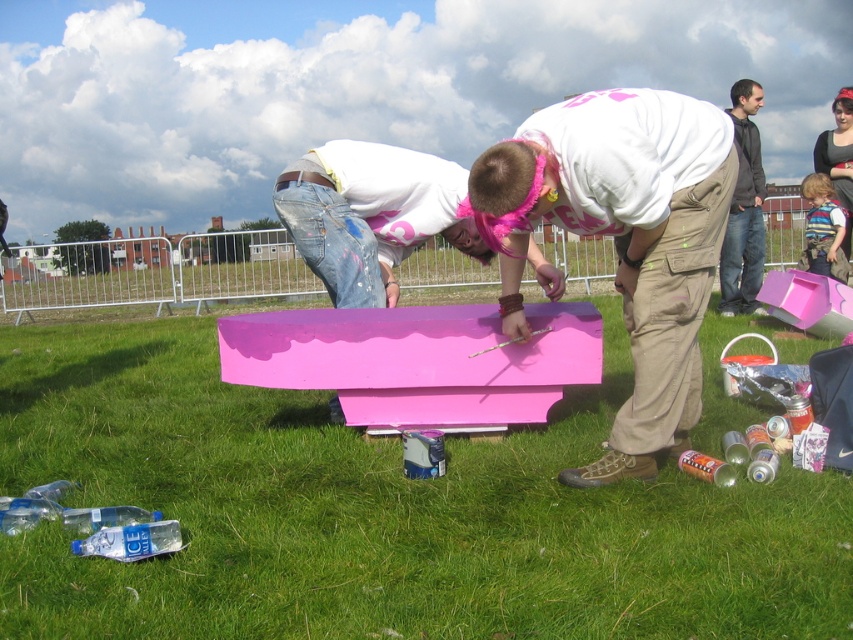
Can you confirm if pink matte paint can at center is thinner than striped sweater at lower right?

No.

Does pink matte paint can at center appear over striped sweater at lower right?

No, pink matte paint can at center is not above striped sweater at lower right.

Which is behind, point (370, 182) or point (846, 268)?

The point (846, 268) is more distant.

Identify the location of pink matte paint can at center. The image size is (853, 640). (370, 214).

Does green grass at center appear under pink matte paint can at center?

Indeed, green grass at center is positioned under pink matte paint can at center.

What do you see at coordinates (381, 513) in the screenshot? I see `green grass at center` at bounding box center [381, 513].

You are a GUI agent. You are given a task and a screenshot of the screen. Output one action in this format:
    pyautogui.click(x=<x>, y=<y>)
    Task: Click on the green grass at center
    This screenshot has width=853, height=640.
    Given the screenshot: What is the action you would take?
    pyautogui.click(x=381, y=513)

Is pink matte wood at center smaller than pink matte paint can at center?

No, pink matte wood at center is not smaller than pink matte paint can at center.

Is pink matte wood at center to the right of pink matte paint can at center from the viewer's perspective?

Yes, pink matte wood at center is to the right of pink matte paint can at center.

Image resolution: width=853 pixels, height=640 pixels. Describe the element at coordinates (622, 240) in the screenshot. I see `pink matte wood at center` at that location.

This screenshot has width=853, height=640. I want to click on pink matte wood at center, so click(x=622, y=240).